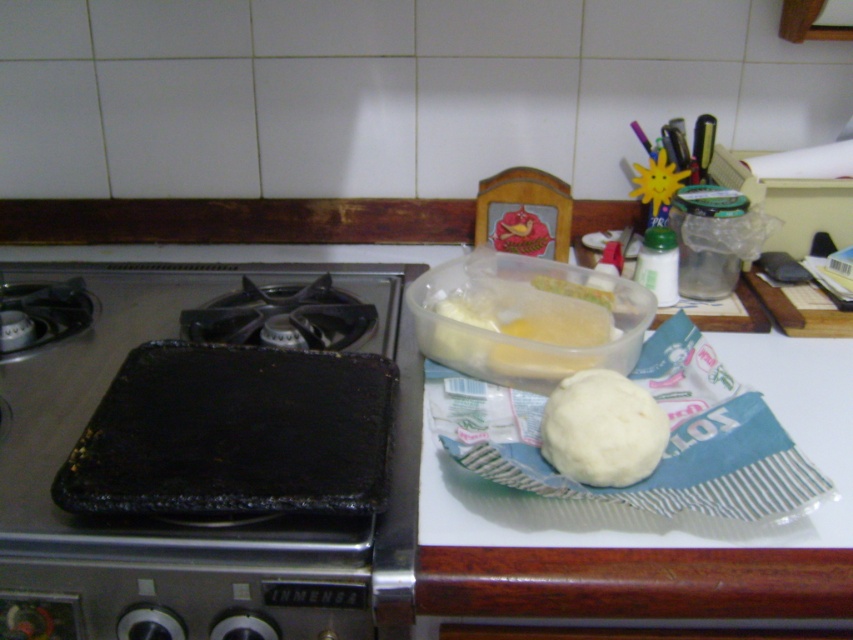
Question: Is black non-stick griddle at center positioned in front of translucent plastic container at center?

Choices:
 (A) yes
 (B) no

Answer: (A)

Question: Estimate the real-world distances between objects in this image. Which object is farther from the translucent plastic container at center?

Choices:
 (A) black non-stick griddle at center
 (B) white matte dough at center

Answer: (A)

Question: Which of the following is the farthest from the observer?

Choices:
 (A) white matte dough at center
 (B) black non-stick griddle at center
 (C) translucent plastic container at center

Answer: (C)

Question: Can you confirm if black non-stick griddle at center is bigger than white matte dough at center?

Choices:
 (A) yes
 (B) no

Answer: (A)

Question: Is black non-stick griddle at center to the left of white matte dough at center from the viewer's perspective?

Choices:
 (A) yes
 (B) no

Answer: (A)

Question: Estimate the real-world distances between objects in this image. Which object is farther from the black non-stick griddle at center?

Choices:
 (A) translucent plastic container at center
 (B) white matte dough at center

Answer: (B)